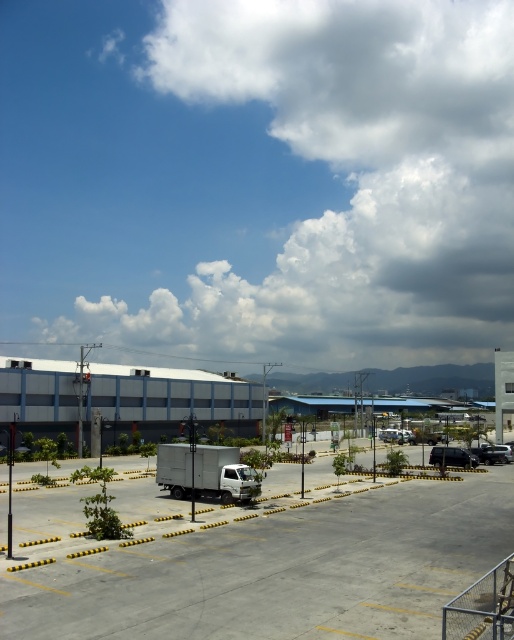
Question: Can you confirm if metallic silver truck at lower right is positioned to the right of silver metallic sedan at center?

Choices:
 (A) no
 (B) yes

Answer: (A)

Question: Considering the real-world distances, which object is closest to the silver metallic sedan at center?

Choices:
 (A) shiny silver sedan at lower right
 (B) dark gray concrete building at left
 (C) white fluffy cloud at upper center
 (D) gray matte truck at center

Answer: (B)

Question: Which object is the farthest from the white fluffy cloud at upper center?

Choices:
 (A) silver metallic sedan at center
 (B) white matte truck at lower left

Answer: (B)

Question: Observing the image, what is the correct spatial positioning of white fluffy cloud at upper center in reference to shiny silver sedan at lower right?

Choices:
 (A) left
 (B) right

Answer: (A)

Question: Does white fluffy cloud at upper center have a greater width compared to shiny silver sedan at lower right?

Choices:
 (A) yes
 (B) no

Answer: (A)

Question: Which of these objects is positioned closest to the shiny silver sedan at lower right?

Choices:
 (A) white matte truck at lower left
 (B) gray matte truck at center
 (C) metallic silver truck at lower right

Answer: (C)